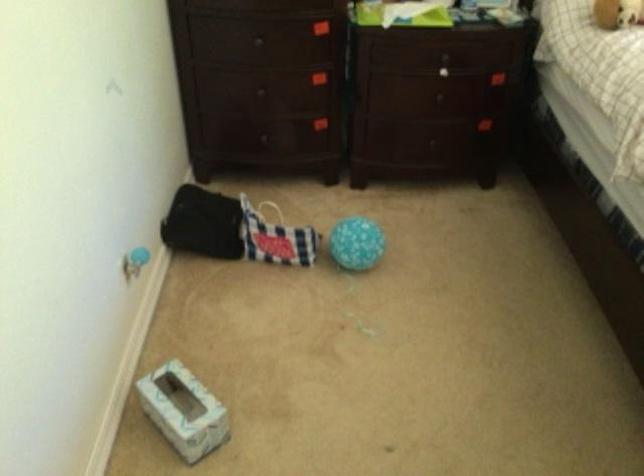
What do you see at coordinates (355, 242) in the screenshot? I see `the blue patterned ball` at bounding box center [355, 242].